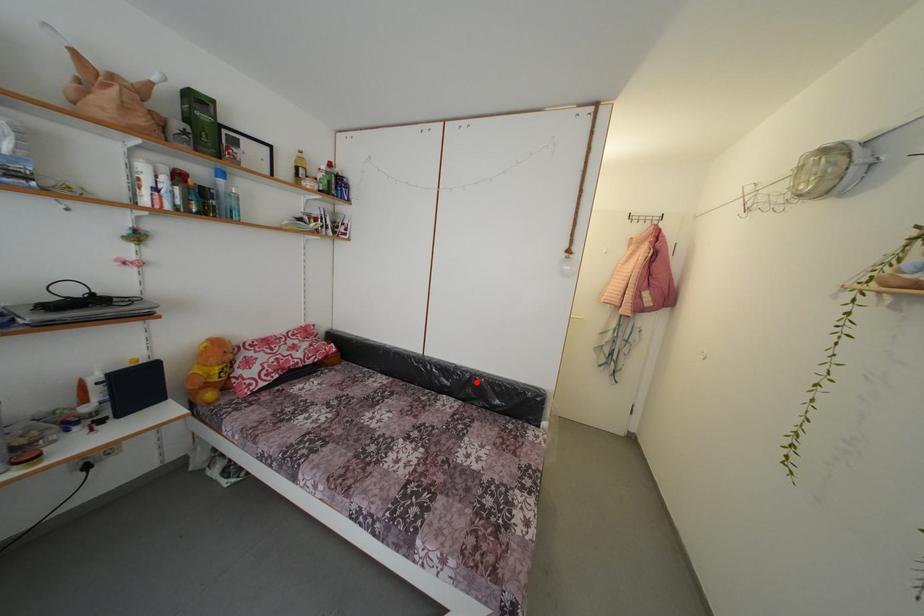
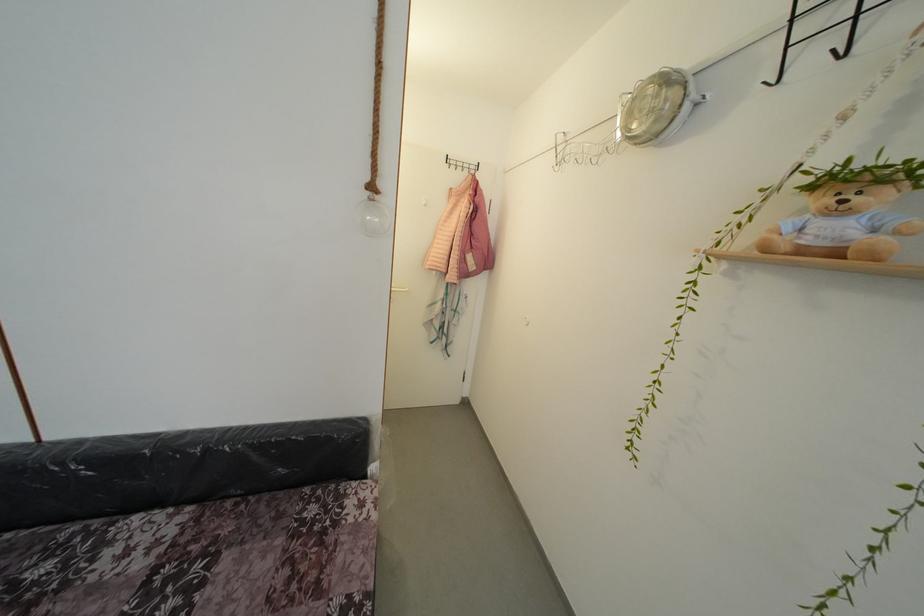
Locate, in the second image, the point that corresponds to the highlighted location in the first image.

(213, 456)